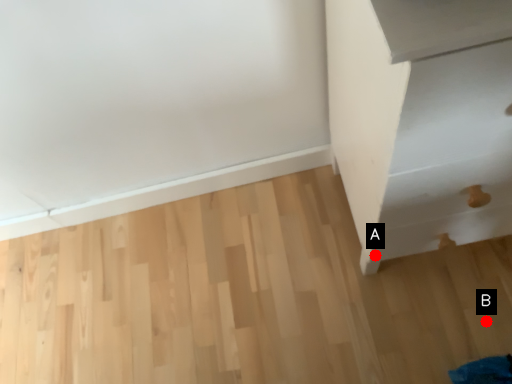
Question: Two points are circled on the image, labeled by A and B beside each circle. Which point is closer to the camera?

Choices:
 (A) A is closer
 (B) B is closer

Answer: (A)